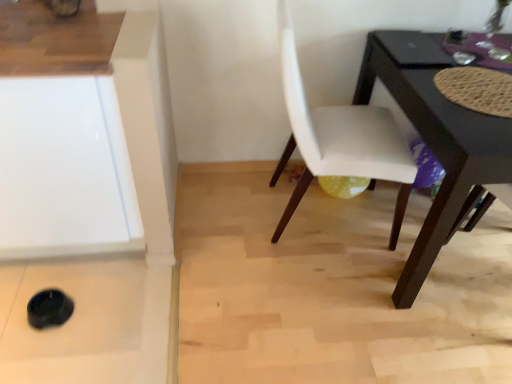
The height and width of the screenshot is (384, 512). Identify the location of vacant area that lies between white leather chair at center and glossy black table at lower right. (337, 269).